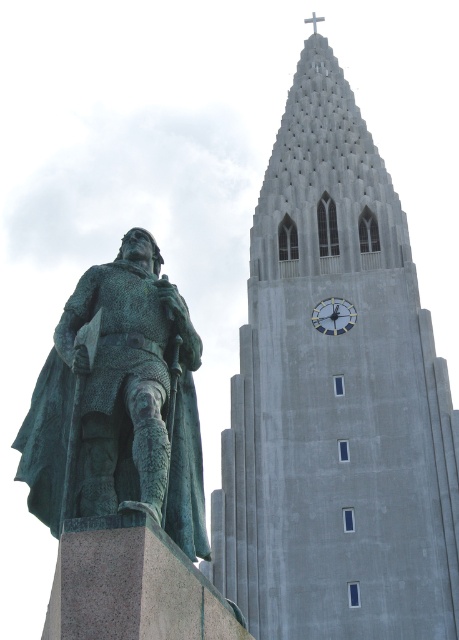
You are an urban planner assessing the visual balance between the gray concrete tower at upper center and the green patina statue at left. Based on their widths, which structure would appear more imposing from the observer standing in front of them?

The gray concrete tower at upper center appears more imposing because its width surpasses that of the green patina statue at left.

You are standing in front of the statue and the modern building. You notice two points marked in the image. One is at coordinate point [55,420] and the other at point [346,308]. Which point is nearer to your current position?

Point [55,420] is closer to the camera than point [346,308], so the point at [55,420] is nearer to your current position.

You are an urban planner assessing the visual impact of the gray concrete tower at upper center and the green patina statue at left. Which object would likely dominate the skyline more based on their sizes?

The gray concrete tower at upper center has a larger size compared to the green patina statue at left, so it would dominate the skyline more.